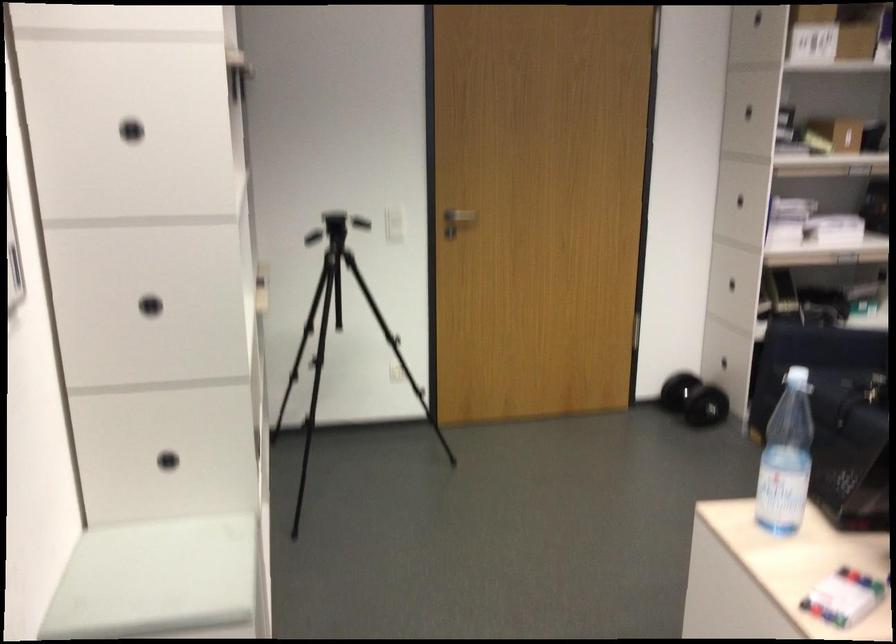
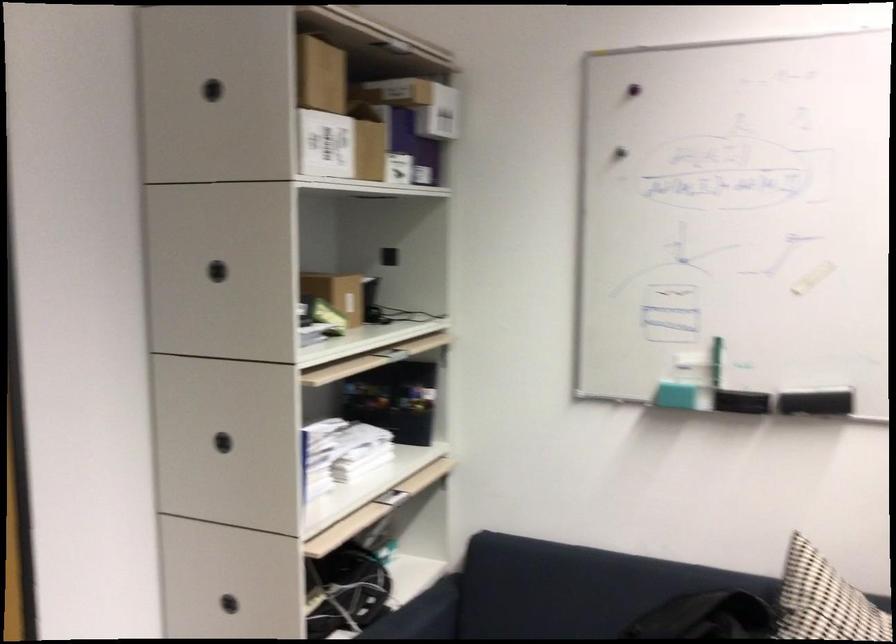
Find the pixel in the second image that matches [717,294] in the first image.

(228, 603)